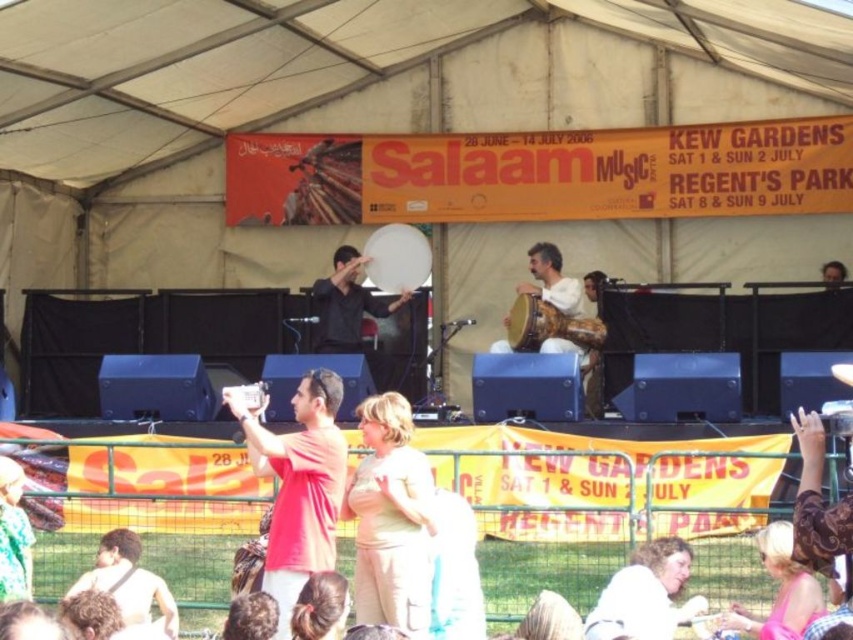
You are a photographer standing at the camera position. You want to capture a closeup shot of the beige cotton dress at center. Considering the distance, is it feasible to take the photo without moving closer?

The beige cotton dress at center is 75.91 feet away from the camera. This distance is quite far, so capturing a closeup shot without moving closer would be challenging and may result in a blurry or unclear image unless using a high zoom lens.

What is the spatial relationship between the light brown hair at lower center and the other objects in the scene?

The light brown hair at lower center is positioned at coordinates point (643, 595), but without additional object descriptions, I cannot compare its location to other objects.

You are standing at the entrance of the Salaam Music event at Kew Gardens. You see two points marked in the image. The first point is at coordinate point (722, 618) and the second is at coordinate point (143, 577). Which point is closer to you?

Point (722, 618) is in front of point (143, 577), so it is closer to you.